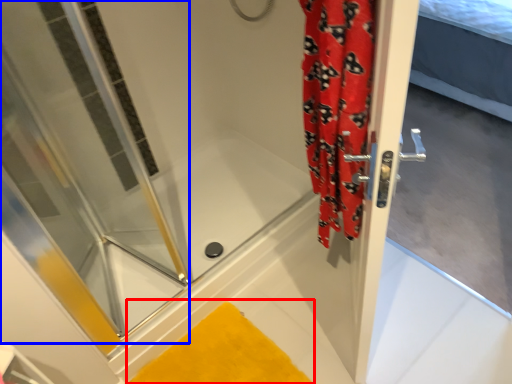
Question: Which of the following is the farthest to the observer, bath mat (highlighted by a red box) or shower door (highlighted by a blue box)?

Choices:
 (A) bath mat
 (B) shower door

Answer: (A)